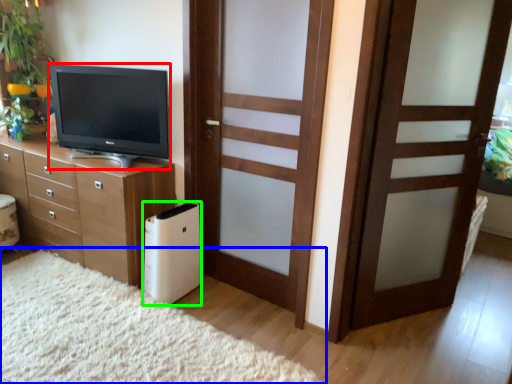
Question: Considering the real-world distances, which object is farthest from television (highlighted by a red box)? plain (highlighted by a blue box) or appliance (highlighted by a green box)?

Choices:
 (A) plain
 (B) appliance

Answer: (A)